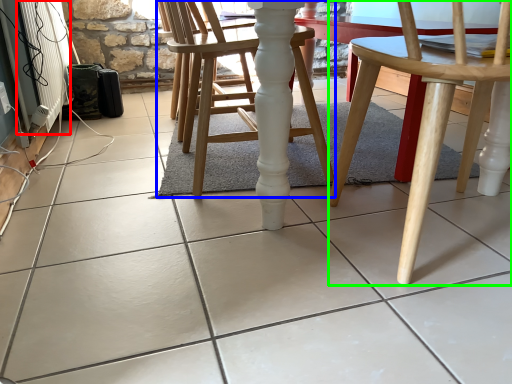
Question: Considering the real-world distances, which object is farthest from radiator (highlighted by a red box)? chair (highlighted by a blue box) or chair (highlighted by a green box)?

Choices:
 (A) chair
 (B) chair

Answer: (B)